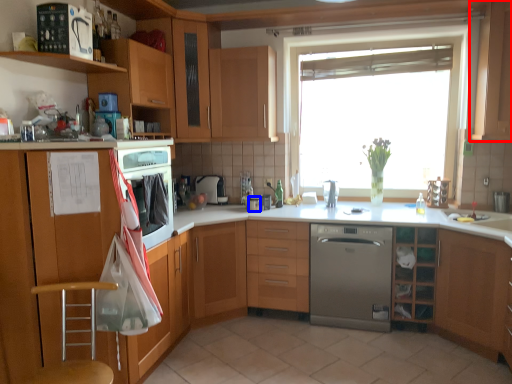
Question: Which object appears farthest to the camera in this image, cabinetry (highlighted by a red box) or appliance (highlighted by a blue box)?

Choices:
 (A) cabinetry
 (B) appliance

Answer: (B)